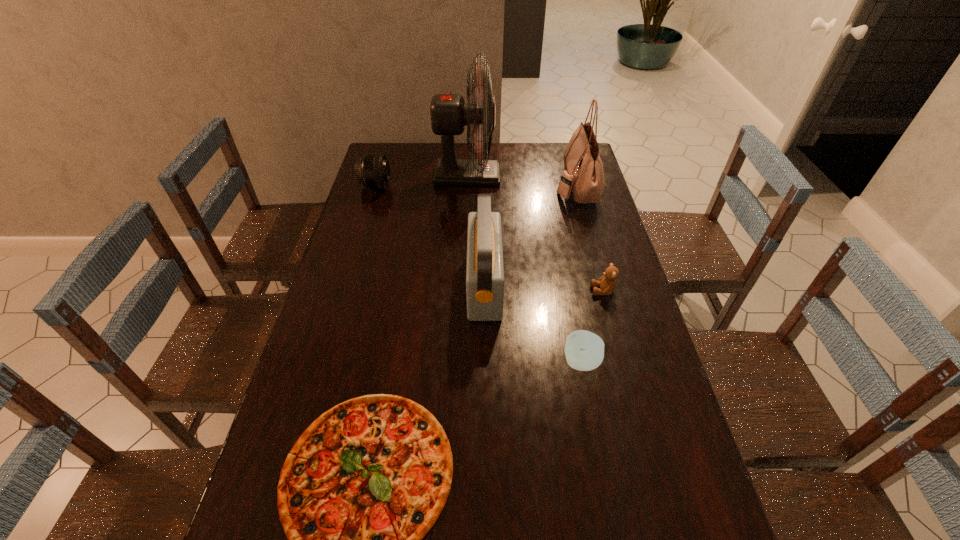
The height and width of the screenshot is (540, 960). What are the coordinates of `the tallest object` in the screenshot? It's located at (449, 113).

This screenshot has width=960, height=540. I want to click on the second tallest object, so [583, 176].

Image resolution: width=960 pixels, height=540 pixels. Identify the location of the third tallest object. (485, 280).

Locate an element on the screen. This screenshot has width=960, height=540. telephoto lens is located at coordinates (372, 170).

You are a GUI agent. You are given a task and a screenshot of the screen. Output one action in this format:
    pyautogui.click(x=<x>, y=<y>)
    Task: Click on the sixth farthest object
    
    Given the screenshot: What is the action you would take?
    pyautogui.click(x=584, y=350)

Locate an element on the screen. teddy bear is located at coordinates (607, 283).

Where is `vacant area located on the front-facing side of the fan`? The width and height of the screenshot is (960, 540). vacant area located on the front-facing side of the fan is located at coordinates (517, 177).

This screenshot has width=960, height=540. Find the location of `free spot located 0.280m on the side of the handbag with the attached pouch`. free spot located 0.280m on the side of the handbag with the attached pouch is located at coordinates click(483, 186).

Find the location of a particular element. free location located 0.240m on the side of the handbag with the attached pouch is located at coordinates (493, 186).

Where is `vacant region located 0.140m on the side of the handbag with the attached pouch`? Image resolution: width=960 pixels, height=540 pixels. vacant region located 0.140m on the side of the handbag with the attached pouch is located at coordinates (519, 186).